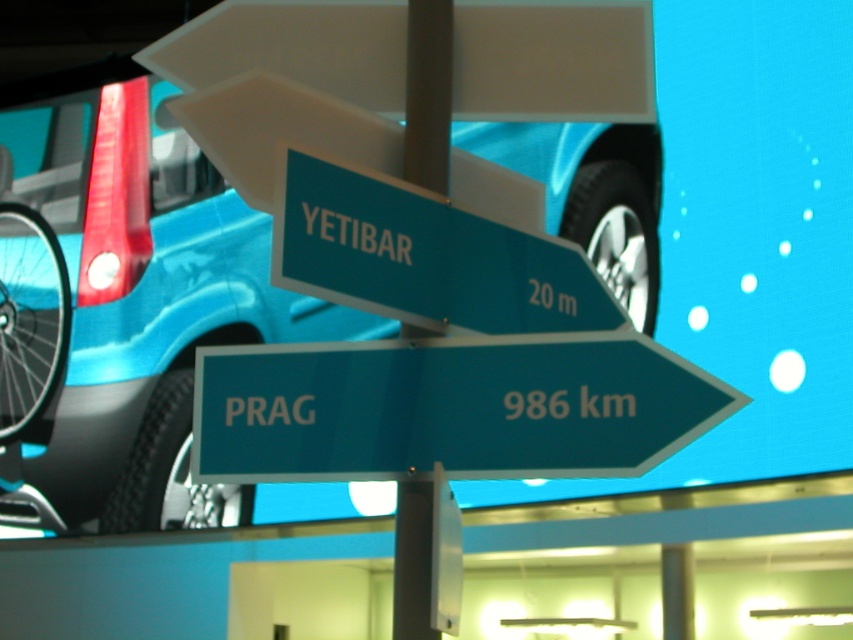
Question: In this image, where is metallic blue car at center located relative to white glossy sign at center?

Choices:
 (A) left
 (B) right

Answer: (A)

Question: Is white glossy sign at center thinner than green plastic sign at center?

Choices:
 (A) yes
 (B) no

Answer: (A)

Question: Which of the following is the closest to the observer?

Choices:
 (A) (595, 172)
 (B) (408, 26)

Answer: (B)

Question: Can you confirm if white glossy sign at center is thinner than metallic pole at center?

Choices:
 (A) no
 (B) yes

Answer: (A)

Question: Which point is closer to the camera?

Choices:
 (A) pyautogui.click(x=357, y=564)
 (B) pyautogui.click(x=534, y=248)
 (C) pyautogui.click(x=553, y=225)

Answer: (B)

Question: Which point appears farthest from the camera in this image?

Choices:
 (A) (422, 99)
 (B) (399, 448)
 (C) (212, 296)
 (D) (460, 269)

Answer: (C)